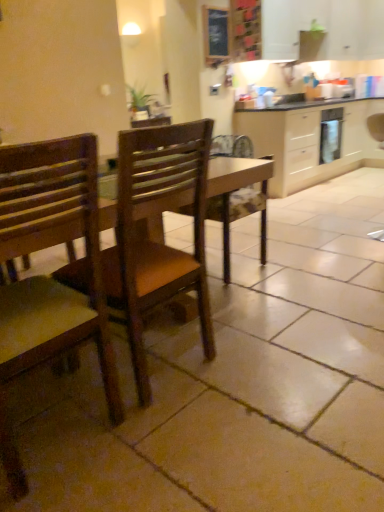
You are a GUI agent. You are given a task and a screenshot of the screen. Output one action in this format:
    pyautogui.click(x=<x>, y=<y>)
    Task: Click on the free spot below wooden chair at center, which is the 1th chair in right-to-left order (from a real-world perspective)
    The image size is (384, 512).
    Given the screenshot: What is the action you would take?
    pyautogui.click(x=169, y=362)